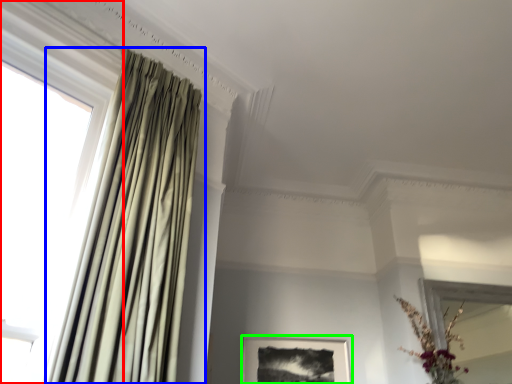
Question: Considering the real-world distances, which object is farthest from window (highlighted by a red box)? curtain (highlighted by a blue box) or picture frame (highlighted by a green box)?

Choices:
 (A) curtain
 (B) picture frame

Answer: (B)